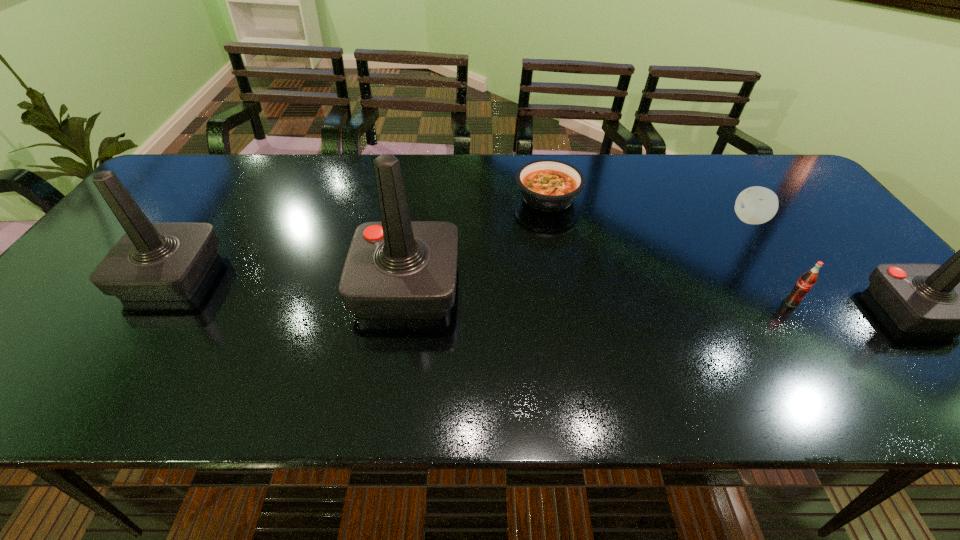
The height and width of the screenshot is (540, 960). What are the coordinates of `unoccupied area between the fifth tallest object and the leftmost object` in the screenshot? It's located at (461, 247).

The height and width of the screenshot is (540, 960). Identify the location of blank region between the soda bottle and the stew. (669, 250).

At what (x,y) coordinates should I click in order to perform the action: click on empty space between the fourth object from right to left and the soda bottle. Please return your answer as a coordinate pair (x, y). The width and height of the screenshot is (960, 540). Looking at the image, I should click on (669, 250).

Point out which object is positioned as the third nearest to the soda bottle. Please provide its 2D coordinates. Your answer should be formatted as a tuple, i.e. [(x, y)], where the tuple contains the x and y coordinates of a point satisfying the conditions above.

[(548, 185)]

Locate an element on the screen. This screenshot has width=960, height=540. object that can be found as the fourth closest to the shortest joystick is located at coordinates (395, 268).

The image size is (960, 540). In order to click on joystick object that ranks as the second closest to the tallest joystick in this screenshot , I will do click(x=959, y=296).

You are a GUI agent. You are given a task and a screenshot of the screen. Output one action in this format:
    pyautogui.click(x=<x>, y=<y>)
    Task: Click on the joystick that is the nearest to the rightmost object
    Image resolution: width=960 pixels, height=540 pixels.
    Given the screenshot: What is the action you would take?
    pyautogui.click(x=395, y=268)